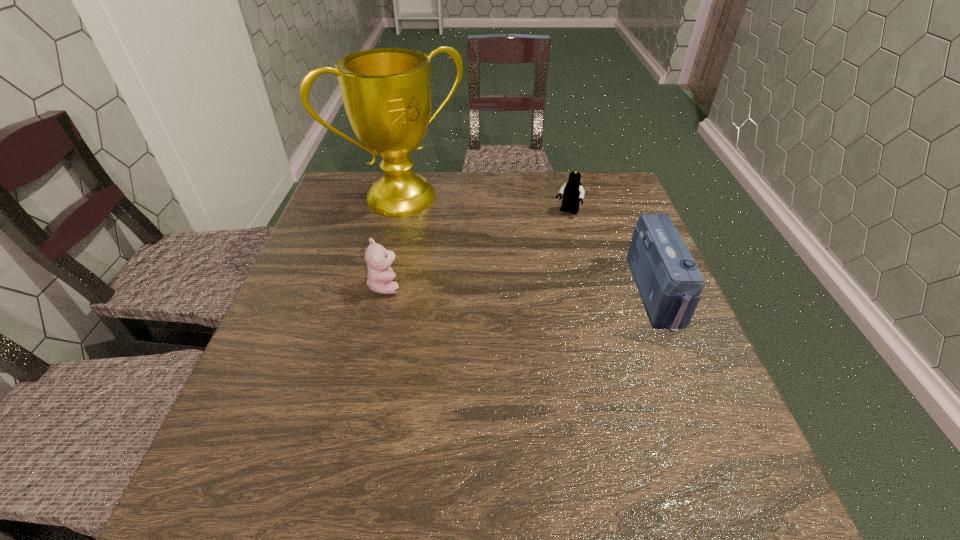
Locate an element on the screen. teddy bear is located at coordinates (378, 259).

At what (x,y) coordinates should I click in order to perform the action: click on the rightmost object. Please return your answer as a coordinate pair (x, y). The height and width of the screenshot is (540, 960). Looking at the image, I should click on (669, 282).

Where is `award`? award is located at coordinates (386, 92).

You are a GUI agent. You are given a task and a screenshot of the screen. Output one action in this format:
    pyautogui.click(x=<x>, y=<y>)
    Task: Click on the Lego
    
    Given the screenshot: What is the action you would take?
    pyautogui.click(x=573, y=192)

Where is `vacant space located at the face of the teddy bear`? The height and width of the screenshot is (540, 960). vacant space located at the face of the teddy bear is located at coordinates (440, 285).

This screenshot has width=960, height=540. Identify the location of free space located 0.090m on the shiny surface of the tallest object. (450, 232).

The height and width of the screenshot is (540, 960). I want to click on free space located on the shiny surface of the tallest object, so click(x=482, y=266).

What are the coordinates of `free point located on the shiny surface of the tallest object` in the screenshot? It's located at (450, 232).

Where is `vacant area situated on the front-facing side of the third object from left to right`? vacant area situated on the front-facing side of the third object from left to right is located at coordinates (543, 252).

Where is `vacant area situated on the front-facing side of the third object from left to right`? This screenshot has height=540, width=960. vacant area situated on the front-facing side of the third object from left to right is located at coordinates (528, 278).